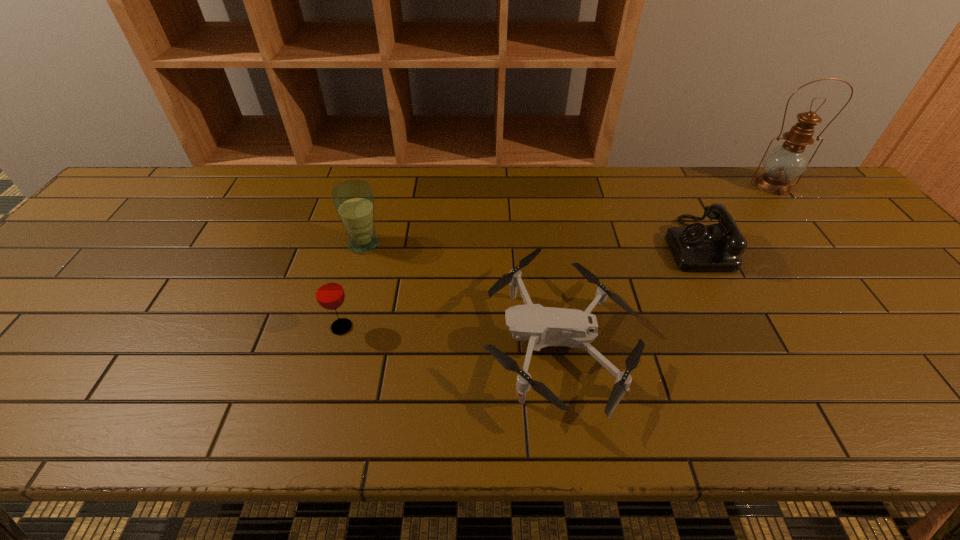
Locate an element on the screen. This screenshot has width=960, height=540. free point between the oil lamp and the farther glass is located at coordinates (568, 214).

This screenshot has height=540, width=960. I want to click on unoccupied position between the nearer glass and the farther glass, so click(x=353, y=285).

Identify the location of vacant area that lies between the tallest object and the shortest object. The image size is (960, 540). (666, 264).

Locate an element on the screen. This screenshot has width=960, height=540. free spot between the rightmost object and the telephone is located at coordinates [x=734, y=214].

Image resolution: width=960 pixels, height=540 pixels. I want to click on object that stands as the second closest to the shortest object, so 353,200.

At what (x,y) coordinates should I click in order to perform the action: click on object that is the fourth closest to the nearer glass. Please return your answer as a coordinate pair (x, y). Looking at the image, I should click on (785, 162).

Identify the location of free point that satisfies the following two spatial constraints: 1. on the dial of the second shortest object; 2. on the front side of the nearer glass. (737, 327).

Find the location of a particular element. The height and width of the screenshot is (540, 960). vacant space that satisfies the following two spatial constraints: 1. on the back side of the tallest object; 2. on the left side of the farther glass is located at coordinates (380, 185).